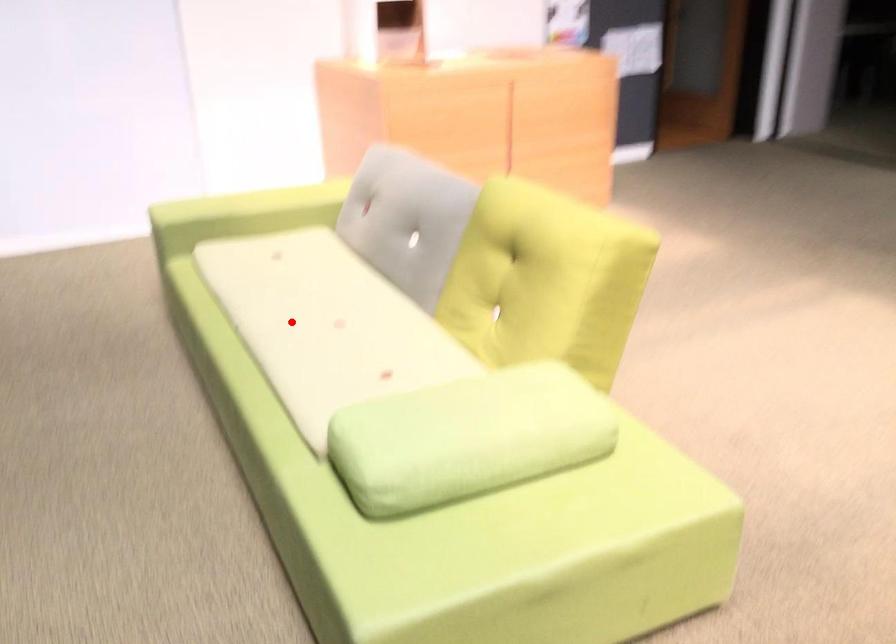
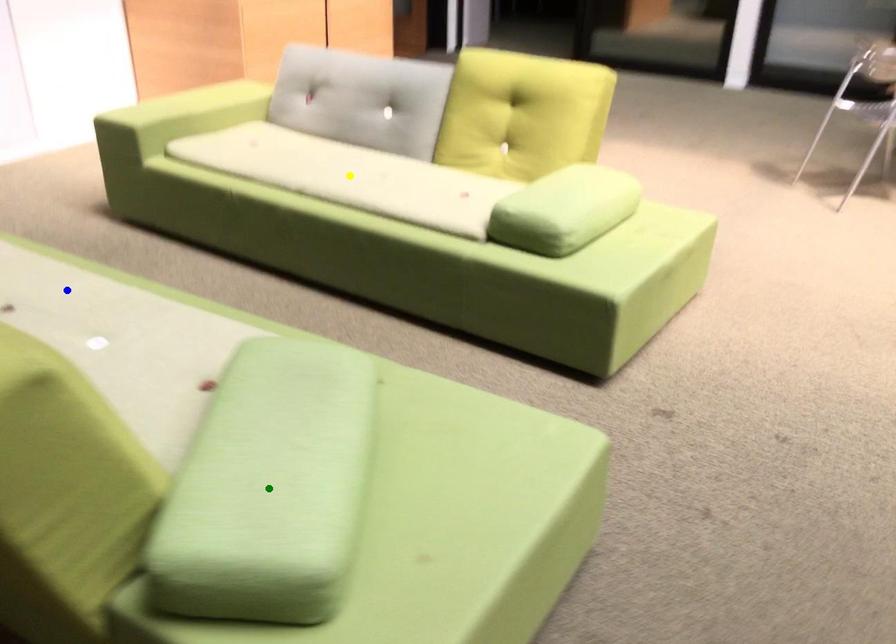
Question: I am providing you with two images of the same scene from different viewpoints. A red point is marked on the first image. You are given multiple points on the second image. Can you choose the point in image 2 that corresponds to the point in image 1?

Choices:
 (A) blue point
 (B) green point
 (C) yellow point

Answer: (C)